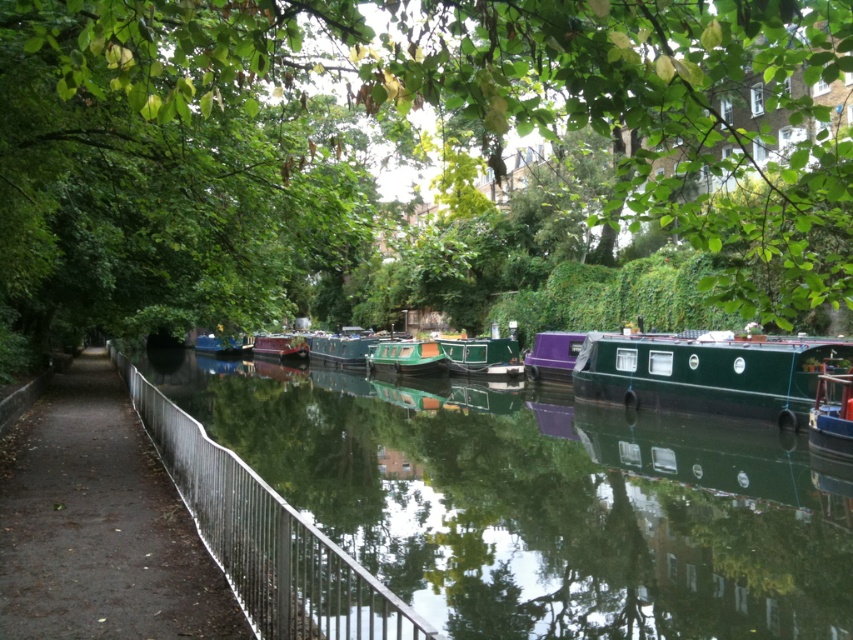
Between green leafy tree at center and green glossy water at center, which one is positioned lower?

green glossy water at center is below.

Can you confirm if green leafy tree at center is shorter than green glossy water at center?

No, green leafy tree at center is not shorter than green glossy water at center.

Which is behind, point (241, 161) or point (602, 481)?

Point (602, 481)

Locate an element on the screen. green leafy tree at center is located at coordinates (399, 113).

Which of these two, green matte boat at center or green polished wood boat at center, stands shorter?

Standing shorter between the two is green polished wood boat at center.

Between green matte boat at center and green polished wood boat at center, which one is positioned lower?

green polished wood boat at center is lower down.

Between point (805, 376) and point (440, 358), which one is positioned behind?

Point (440, 358)

This screenshot has height=640, width=853. What are the coordinates of `green matte boat at center` in the screenshot? It's located at (709, 372).

Can you confirm if green matte boat at center is taller than green glossy boat at center?

Incorrect, green matte boat at center's height is not larger of green glossy boat at center's.

Is green matte boat at center to the right of green glossy boat at center from the viewer's perspective?

Correct, you'll find green matte boat at center to the right of green glossy boat at center.

You are a GUI agent. You are given a task and a screenshot of the screen. Output one action in this format:
    pyautogui.click(x=<x>, y=<y>)
    Task: Click on the green matte boat at center
    This screenshot has height=640, width=853.
    Given the screenshot: What is the action you would take?
    pyautogui.click(x=709, y=372)